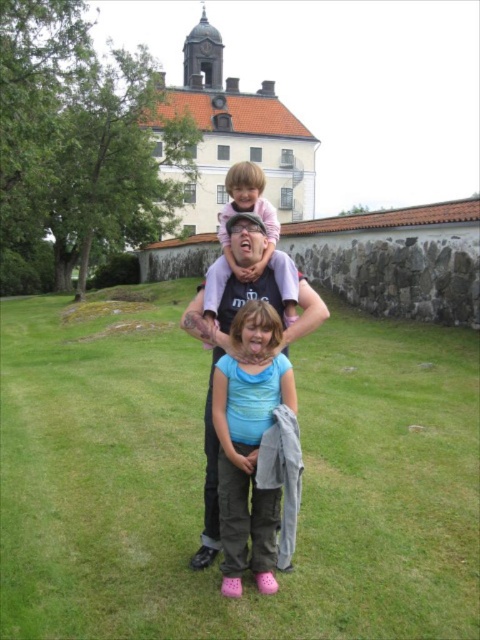
Which of these two, green grass at center or pink fabric at upper center, stands taller?

With more height is pink fabric at upper center.

Does green grass at center appear on the right side of pink fabric at upper center?

Indeed, green grass at center is positioned on the right side of pink fabric at upper center.

Identify the location of green grass at center. The image size is (480, 640). (203, 476).

Which is more to the right, green grass at center or black cotton t-shirt at center?

Positioned to the right is black cotton t-shirt at center.

Based on the photo, can you confirm if green grass at center is smaller than black cotton t-shirt at center?

Actually, green grass at center might be larger than black cotton t-shirt at center.

Is point (19, 538) positioned behind point (310, 323)?

No, it is in front of (310, 323).

The width and height of the screenshot is (480, 640). I want to click on green grass at center, so click(x=203, y=476).

Does matte blue shirt at center appear on the left side of black cotton t-shirt at center?

Incorrect, matte blue shirt at center is not on the left side of black cotton t-shirt at center.

What do you see at coordinates (249, 444) in the screenshot? The width and height of the screenshot is (480, 640). I see `matte blue shirt at center` at bounding box center [249, 444].

You are a GUI agent. You are given a task and a screenshot of the screen. Output one action in this format:
    pyautogui.click(x=<x>, y=<y>)
    Task: Click on the matte blue shirt at center
    This screenshot has width=480, height=640.
    Given the screenshot: What is the action you would take?
    pyautogui.click(x=249, y=444)